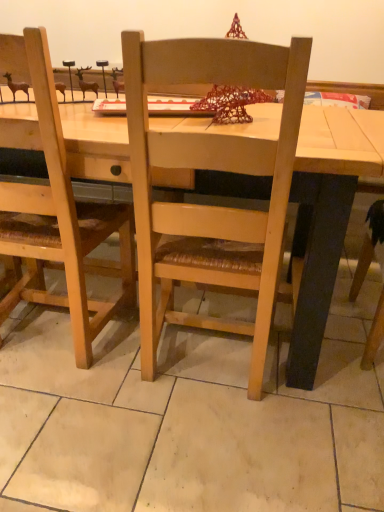
You are a GUI agent. You are given a task and a screenshot of the screen. Output one action in this format:
    pyautogui.click(x=<x>, y=<y>)
    Task: Click on the vacant space to the right of natural wood chair at center
    The image size is (384, 512).
    Given the screenshot: What is the action you would take?
    pyautogui.click(x=328, y=378)